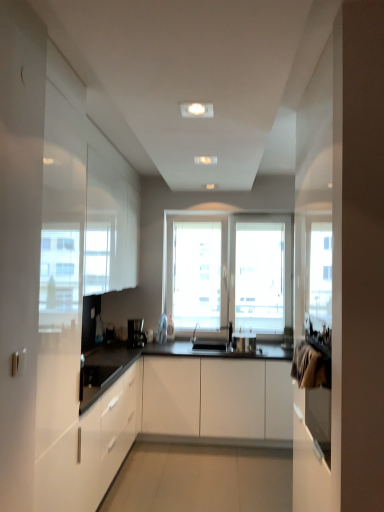
The image size is (384, 512). What are the coordinates of `white glossy cabinet at left, positioned as the second cabinetry in right-to-left order` in the screenshot? It's located at (91, 449).

Describe the element at coordinates (91, 449) in the screenshot. I see `white glossy cabinet at left, which is counted as the 1th cabinetry, starting from the left` at that location.

Identify the location of white matte cabinet at center, which appears as the second cabinetry when viewed from the left. This screenshot has width=384, height=512. (217, 398).

What do you see at coordinates (244, 342) in the screenshot? I see `metallic silver pot at center` at bounding box center [244, 342].

At what (x,y) coordinates should I click in order to perform the action: click on metallic silver pot at center. Please return your answer as a coordinate pair (x, y). The width and height of the screenshot is (384, 512). Looking at the image, I should click on (244, 342).

Identify the location of white glossy cabinet at left, which is counted as the 1th cabinetry, starting from the left. (91, 449).

Identify the location of appliance behind the white glossy cabinet at left, positioned as the second cabinetry in right-to-left order. (244, 342).

How different are the orientations of white glossy cabinet at left, positioned as the second cabinetry in right-to-left order, and metallic silver pot at center in degrees?

There is a 93.2-degree angle between the facing directions of white glossy cabinet at left, positioned as the second cabinetry in right-to-left order, and metallic silver pot at center.

Is white glossy cabinet at left, which is counted as the 1th cabinetry, starting from the left, thinner than metallic silver pot at center?

In fact, white glossy cabinet at left, which is counted as the 1th cabinetry, starting from the left, might be wider than metallic silver pot at center.

From a real-world perspective, is white glossy cabinet at left, positioned as the second cabinetry in right-to-left order, under metallic silver pot at center?

Indeed, from a real-world perspective, white glossy cabinet at left, positioned as the second cabinetry in right-to-left order, is positioned beneath metallic silver pot at center.

In terms of width, does white matte cabinet at center, acting as the 1th cabinetry starting from the right, look wider or thinner when compared to white glossy cabinet at left, positioned as the second cabinetry in right-to-left order?

Clearly, white matte cabinet at center, acting as the 1th cabinetry starting from the right, has more width compared to white glossy cabinet at left, positioned as the second cabinetry in right-to-left order.

Is white matte cabinet at center, which appears as the second cabinetry when viewed from the left, positioned far away from white glossy cabinet at left, positioned as the second cabinetry in right-to-left order?

Yes, white matte cabinet at center, which appears as the second cabinetry when viewed from the left, and white glossy cabinet at left, positioned as the second cabinetry in right-to-left order, are located far from each other.

From the image's perspective, which one is positioned higher, white matte cabinet at center, which appears as the second cabinetry when viewed from the left, or white glossy cabinet at left, positioned as the second cabinetry in right-to-left order?

white glossy cabinet at left, positioned as the second cabinetry in right-to-left order, from the image's perspective.

Is white matte cabinet at center, acting as the 1th cabinetry starting from the right, turned away from white glossy cabinet at left, positioned as the second cabinetry in right-to-left order?

No.

Can you tell me how much black plastic coffee machine at center and white matte cabinet at center, acting as the 1th cabinetry starting from the right, differ in facing direction?

28.4 degrees separate the facing orientations of black plastic coffee machine at center and white matte cabinet at center, acting as the 1th cabinetry starting from the right.

Is black plastic coffee machine at center positioned with its back to white matte cabinet at center, acting as the 1th cabinetry starting from the right?

No, black plastic coffee machine at center's orientation is not away from white matte cabinet at center, acting as the 1th cabinetry starting from the right.

Is black plastic coffee machine at center at the left side of white matte cabinet at center, acting as the 1th cabinetry starting from the right?

Yes.

From a real-world perspective, is black plastic coffee machine at center positioned under white matte cabinet at center, which appears as the second cabinetry when viewed from the left, based on gravity?

Incorrect, from a real-world perspective, black plastic coffee machine at center is higher than white matte cabinet at center, which appears as the second cabinetry when viewed from the left.

Which is more to the right, metallic silver pot at center or white matte cabinet at center, acting as the 1th cabinetry starting from the right?

Positioned to the right is metallic silver pot at center.

Is metallic silver pot at center bigger than white matte cabinet at center, which appears as the second cabinetry when viewed from the left?

No, metallic silver pot at center is not bigger than white matte cabinet at center, which appears as the second cabinetry when viewed from the left.

Looking at this image, is metallic silver pot at center positioned with its back to black plastic coffee machine at center?

metallic silver pot at center does not have its back to black plastic coffee machine at center.

In terms of size, does metallic silver pot at center appear bigger or smaller than black plastic coffee machine at center?

Clearly, metallic silver pot at center is larger in size than black plastic coffee machine at center.

Between metallic silver pot at center and black plastic coffee machine at center, which one is positioned behind?

black plastic coffee machine at center is further from the camera.

From a real-world perspective, is metallic silver pot at center beneath black plastic coffee machine at center?

Yes.

From a real-world perspective, relative to black plastic coffee machine at center, is white matte cabinet at center, acting as the 1th cabinetry starting from the right, vertically above or below?

From a real-world perspective, white matte cabinet at center, acting as the 1th cabinetry starting from the right, is physically below black plastic coffee machine at center.

Which of these two, white matte cabinet at center, acting as the 1th cabinetry starting from the right, or black plastic coffee machine at center, is smaller?

black plastic coffee machine at center is smaller.

What's the angular difference between white matte cabinet at center, which appears as the second cabinetry when viewed from the left, and black plastic coffee machine at center's facing directions?

The angular difference between white matte cabinet at center, which appears as the second cabinetry when viewed from the left, and black plastic coffee machine at center is 28.4 degrees.

Which object is closer to the camera taking this photo, white matte cabinet at center, which appears as the second cabinetry when viewed from the left, or black plastic coffee machine at center?

white matte cabinet at center, which appears as the second cabinetry when viewed from the left, is closer to the camera.

Is white glossy cabinet at left, which is counted as the 1th cabinetry, starting from the left, looking in the opposite direction of black plastic coffee machine at center?

No.

Is white glossy cabinet at left, which is counted as the 1th cabinetry, starting from the left, positioned far away from black plastic coffee machine at center?

Indeed, white glossy cabinet at left, which is counted as the 1th cabinetry, starting from the left, is not near black plastic coffee machine at center.

From a real-world perspective, who is located lower, white glossy cabinet at left, positioned as the second cabinetry in right-to-left order, or black plastic coffee machine at center?

In real-world perspective, white glossy cabinet at left, positioned as the second cabinetry in right-to-left order, is lower.

Locate an element on the screen. This screenshot has height=512, width=384. cabinetry that is the 2nd object to the left of the metallic silver pot at center, starting at the anchor is located at coordinates (91, 449).

Locate an element on the screen. The height and width of the screenshot is (512, 384). cabinetry behind the white glossy cabinet at left, positioned as the second cabinetry in right-to-left order is located at coordinates (217, 398).

From the picture: Which object lies further to the anchor point metallic silver pot at center, black plastic coffee machine at center or white matte cabinet at center, acting as the 1th cabinetry starting from the right?

black plastic coffee machine at center lies further to metallic silver pot at center than the other object.

When comparing their distances from white matte cabinet at center, acting as the 1th cabinetry starting from the right, does metallic silver pot at center or black plastic coffee machine at center seem further?

The object further to white matte cabinet at center, acting as the 1th cabinetry starting from the right, is black plastic coffee machine at center.

Estimate the real-world distances between objects in this image. Which object is further from white matte cabinet at center, which appears as the second cabinetry when viewed from the left, white glossy cabinet at left, positioned as the second cabinetry in right-to-left order, or metallic silver pot at center?

The object further to white matte cabinet at center, which appears as the second cabinetry when viewed from the left, is white glossy cabinet at left, positioned as the second cabinetry in right-to-left order.

Looking at the image, which one is located further to white glossy cabinet at left, positioned as the second cabinetry in right-to-left order, white matte cabinet at center, acting as the 1th cabinetry starting from the right, or metallic silver pot at center?

metallic silver pot at center is positioned further to the anchor white glossy cabinet at left, positioned as the second cabinetry in right-to-left order.

Estimate the real-world distances between objects in this image. Which object is closer to black plastic coffee machine at center, white glossy cabinet at left, which is counted as the 1th cabinetry, starting from the left, or white matte cabinet at center, which appears as the second cabinetry when viewed from the left?

Among the two, white matte cabinet at center, which appears as the second cabinetry when viewed from the left, is located nearer to black plastic coffee machine at center.

From the picture: Which object lies further to the anchor point metallic silver pot at center, black plastic coffee machine at center or white glossy cabinet at left, which is counted as the 1th cabinetry, starting from the left?

Among the two, white glossy cabinet at left, which is counted as the 1th cabinetry, starting from the left, is located further to metallic silver pot at center.

Which object lies further to the anchor point white matte cabinet at center, acting as the 1th cabinetry starting from the right, black plastic coffee machine at center or white glossy cabinet at left, which is counted as the 1th cabinetry, starting from the left?

white glossy cabinet at left, which is counted as the 1th cabinetry, starting from the left, is positioned further to the anchor white matte cabinet at center, acting as the 1th cabinetry starting from the right.

From the picture: Based on their spatial positions, is white matte cabinet at center, acting as the 1th cabinetry starting from the right, or black plastic coffee machine at center closer to white glossy cabinet at left, which is counted as the 1th cabinetry, starting from the left?

white matte cabinet at center, acting as the 1th cabinetry starting from the right, lies closer to white glossy cabinet at left, which is counted as the 1th cabinetry, starting from the left, than the other object.

Identify the location of appliance between white glossy cabinet at left, which is counted as the 1th cabinetry, starting from the left, and black plastic coffee machine at center, along the z-axis. The width and height of the screenshot is (384, 512). (244, 342).

Locate an element on the screen. This screenshot has height=512, width=384. cabinetry positioned between white glossy cabinet at left, positioned as the second cabinetry in right-to-left order, and black plastic coffee machine at center from near to far is located at coordinates (217, 398).

What are the coordinates of `cabinetry between white glossy cabinet at left, positioned as the second cabinetry in right-to-left order, and metallic silver pot at center from front to back` in the screenshot? It's located at (217, 398).

Locate an element on the screen. cabinetry situated between black plastic coffee machine at center and metallic silver pot at center from left to right is located at coordinates (217, 398).